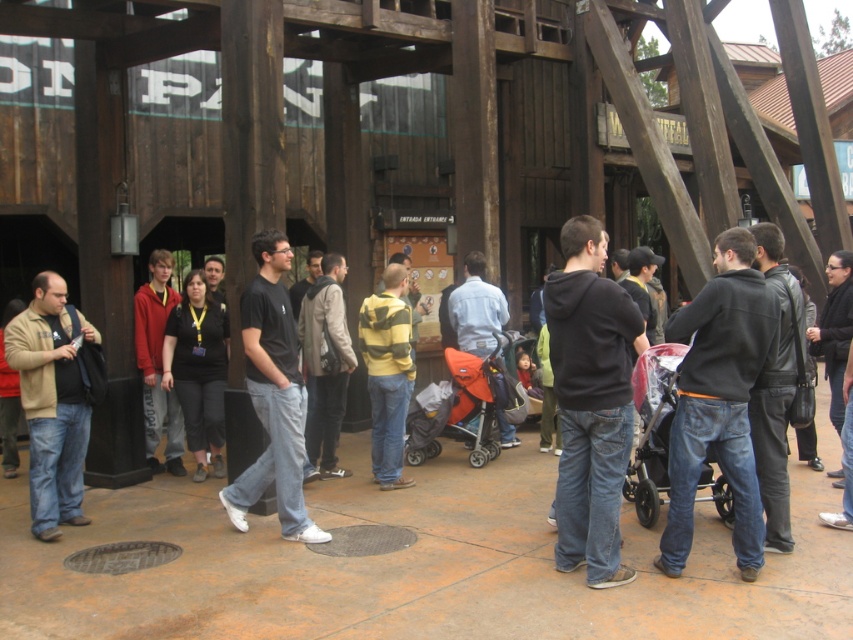
Who is more distant from viewer, (x=624, y=576) or (x=483, y=257)?

Point (x=483, y=257)

How distant is black hoodie at center from denim jacket at center?

black hoodie at center and denim jacket at center are 10.79 feet apart.

Which is in front, point (566, 243) or point (492, 298)?

Positioned in front is point (566, 243).

Where is `black hoodie at center`? The width and height of the screenshot is (853, 640). black hoodie at center is located at coordinates (590, 403).

Can you confirm if striped sweater at center is smaller than matte red hoodie at center?

Actually, striped sweater at center might be larger than matte red hoodie at center.

Between striped sweater at center and matte red hoodie at center, which one is positioned higher?

Result: matte red hoodie at center is higher up.

Which is behind, point (328, 369) or point (144, 312)?

The point (144, 312) is more distant.

The height and width of the screenshot is (640, 853). In order to click on striped sweater at center in this screenshot , I will do `click(325, 364)`.

Is transparent plastic baby carriage at center positioned behind yellow striped sweater at center?

No, it is not.

Does transparent plastic baby carriage at center have a larger size compared to yellow striped sweater at center?

Correct, transparent plastic baby carriage at center is larger in size than yellow striped sweater at center.

Between point (728, 502) and point (310, 276), which one is positioned behind?

The point (310, 276) is behind.

The image size is (853, 640). Identify the location of transparent plastic baby carriage at center. [653, 428].